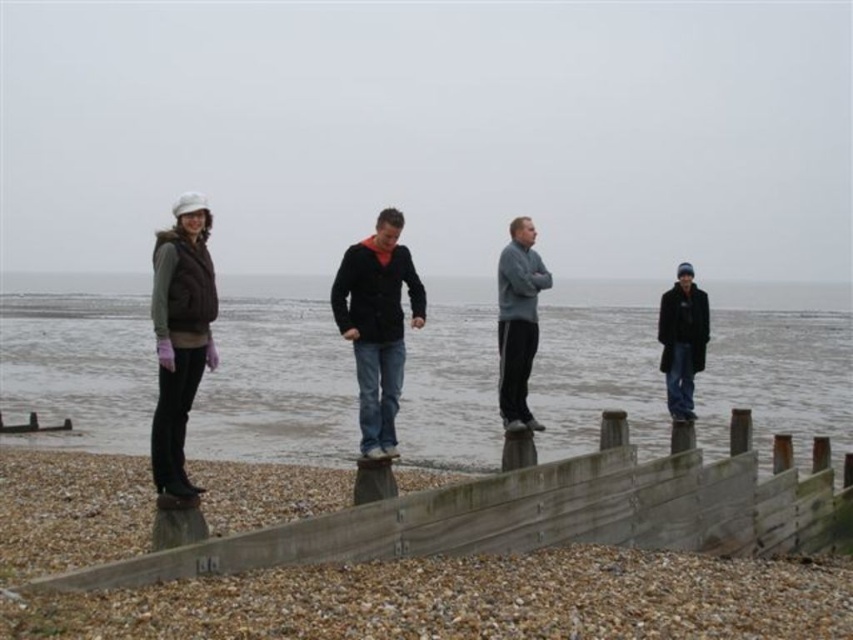
Is weathered wood fence at lower center above dark blue jeans at center?

Incorrect, weathered wood fence at lower center is not positioned above dark blue jeans at center.

Which is more to the left, weathered wood fence at lower center or dark blue jeans at center?

Positioned to the left is dark blue jeans at center.

Does point (590, 508) come behind point (367, 339)?

That is True.

Find the location of `weathered wood fence at lower center`. weathered wood fence at lower center is located at coordinates (541, 513).

Is gray fleece jacket at center further to camera compared to dark blue woolen coat at right?

That is False.

Is point (502, 266) closer to viewer compared to point (672, 314)?

Yes, it is in front of point (672, 314).

Where is `gray fleece jacket at center`? The image size is (853, 640). gray fleece jacket at center is located at coordinates (518, 321).

Does gray water at center appear under matte brown vest at left?

Incorrect, gray water at center is not positioned below matte brown vest at left.

How much distance is there between gray water at center and matte brown vest at left?

The distance of gray water at center from matte brown vest at left is 179.18 feet.

Where is `gray water at center`? This screenshot has height=640, width=853. gray water at center is located at coordinates (276, 385).